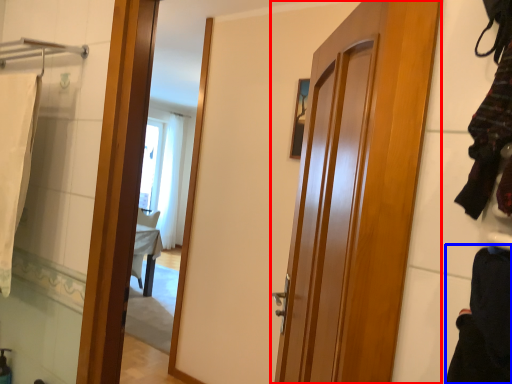
Question: Which of the following is the farthest to the observer, door (highlighted by a red box) or clothing (highlighted by a blue box)?

Choices:
 (A) door
 (B) clothing

Answer: (A)